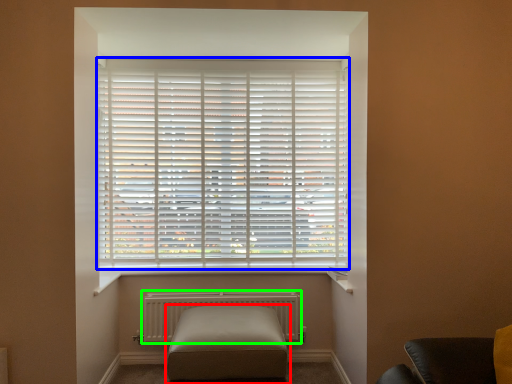
Question: Estimate the real-world distances between objects in this image. Which object is closer to furniture (highlighted by a red box), window blind (highlighted by a blue box) or radiator (highlighted by a green box)?

Choices:
 (A) window blind
 (B) radiator

Answer: (B)